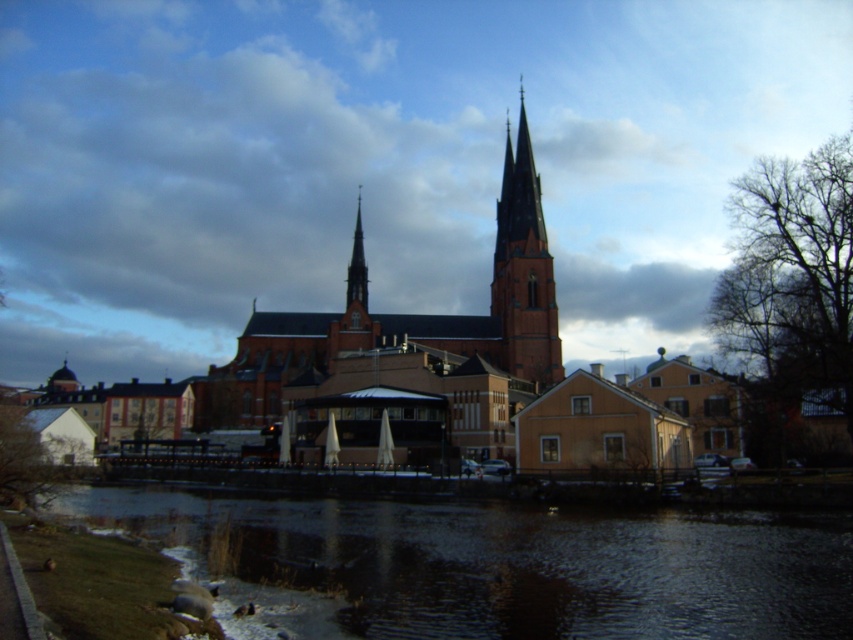
Question: Can you confirm if green grass at lower left is wider than brick steeple at center?

Choices:
 (A) yes
 (B) no

Answer: (A)

Question: Among these points, which one is nearest to the camera?

Choices:
 (A) (531, 288)
 (B) (347, 275)

Answer: (B)

Question: Does green grass at lower left lie behind red brick church at center?

Choices:
 (A) yes
 (B) no

Answer: (B)

Question: Which object appears closest to the camera in this image?

Choices:
 (A) green grass at lower left
 (B) red brick church at center
 (C) smooth red brick spire at center

Answer: (A)

Question: Which object is positioned closest to the red brick church at center?

Choices:
 (A) green grass at lower left
 (B) smooth red brick spire at center
 (C) brick steeple at center

Answer: (C)

Question: Is green grass at lower left positioned behind brick steeple at center?

Choices:
 (A) yes
 (B) no

Answer: (B)